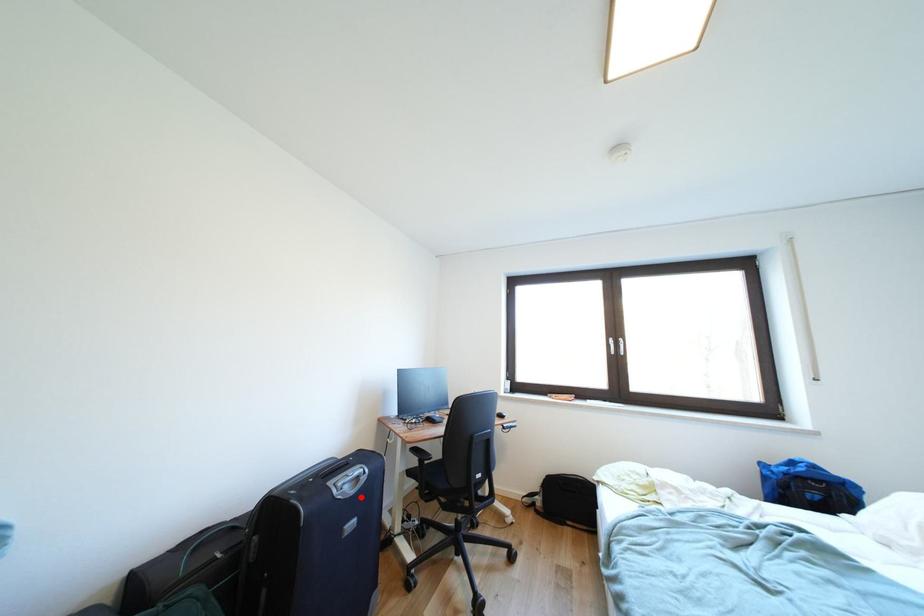
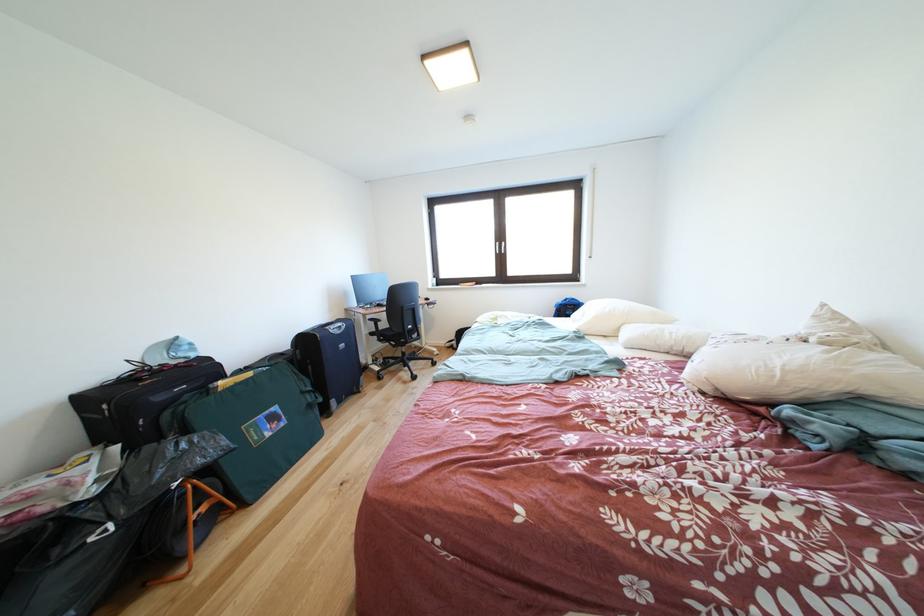
Question: I am providing you with two images of the same scene from different viewpoints. Given a red point in image1, look at the same physical point in image2. Is it:

Choices:
 (A) Closer to the viewpoint
 (B) Farther from the viewpoint

Answer: (A)